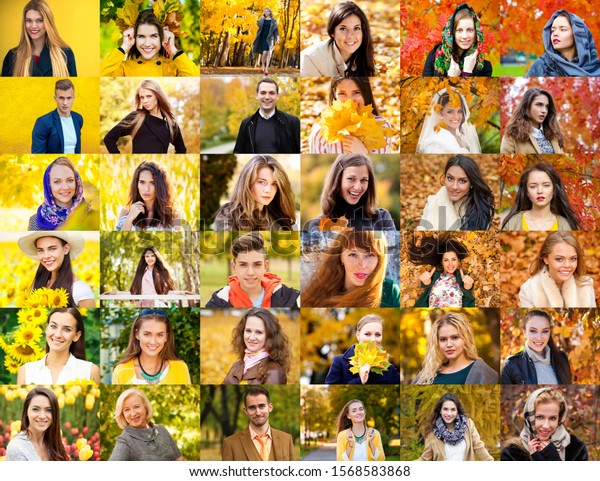
Identify the location of individual pictures on the top row. (35, 25), (145, 45), (266, 34), (343, 38), (462, 36), (565, 32).